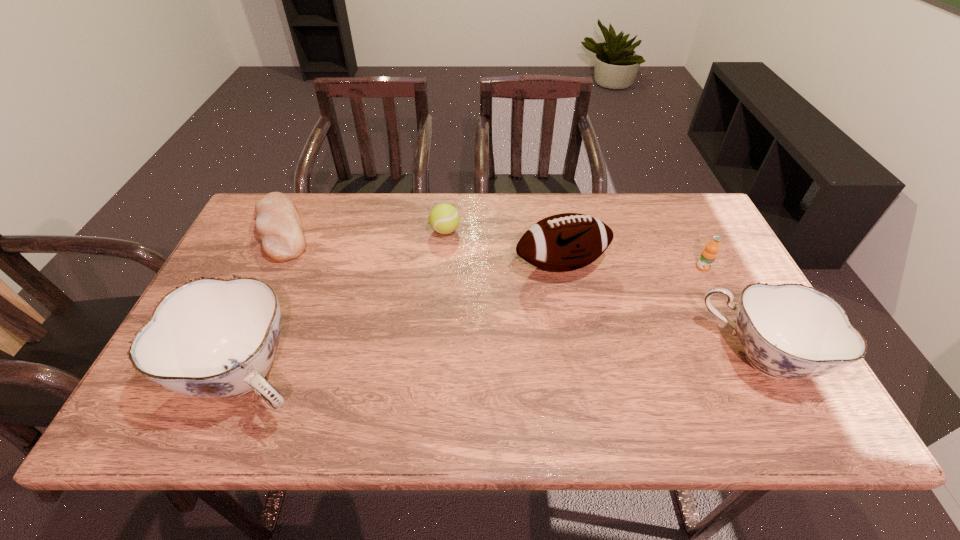
Where is `blank space located on the label of the orange juice`? blank space located on the label of the orange juice is located at coordinates 756,372.

You are a GUI agent. You are given a task and a screenshot of the screen. Output one action in this format:
    pyautogui.click(x=<x>, y=<y>)
    Task: Click on the vacant space situated on the left of the second shortest object
    This screenshot has height=540, width=960.
    Given the screenshot: What is the action you would take?
    pyautogui.click(x=328, y=231)

The height and width of the screenshot is (540, 960). I want to click on vacant position located on the right of the third object from right to left, so click(730, 265).

Find the location of a particular element. bread that is at the far edge is located at coordinates (278, 224).

Identify the location of tennis ball that is positioned at the far edge. (444, 218).

Find the location of a particular element. chinaware positioned at the left edge is located at coordinates (210, 338).

This screenshot has height=540, width=960. I want to click on bread that is at the left edge, so click(278, 224).

Where is `chinaware that is at the right edge`? chinaware that is at the right edge is located at coordinates (790, 331).

The image size is (960, 540). In order to click on orange juice present at the right edge in this screenshot , I will do `click(708, 255)`.

At what (x,y) coordinates should I click in order to perform the action: click on object that is at the far left corner. Please return your answer as a coordinate pair (x, y). The width and height of the screenshot is (960, 540). Looking at the image, I should click on (278, 224).